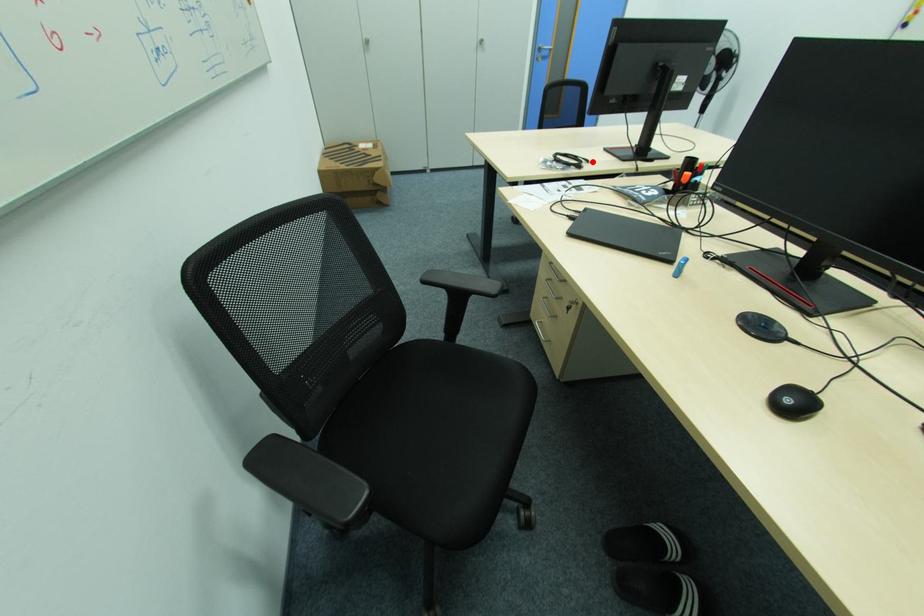
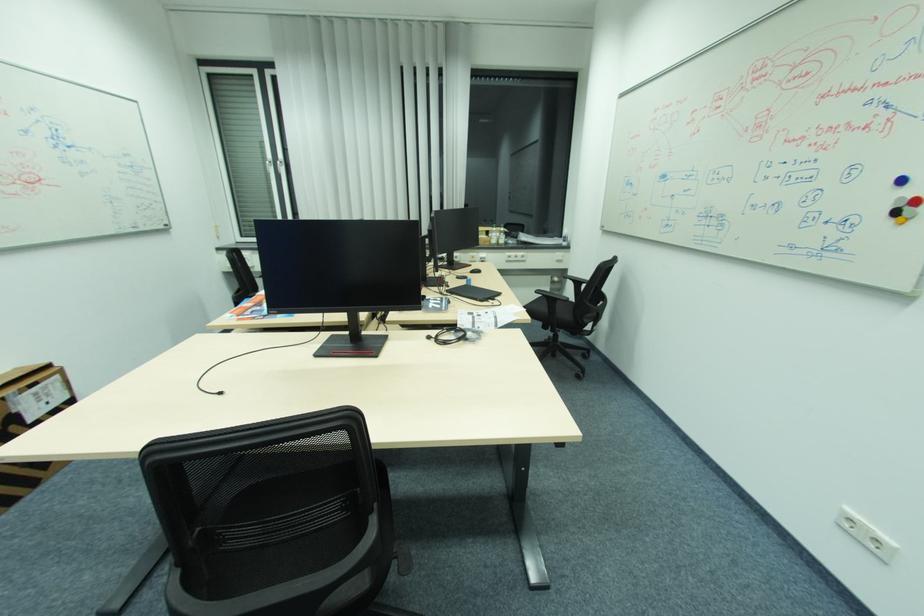
The point at the highlighted location is marked in the first image. Where is the corresponding point in the second image?

(434, 338)